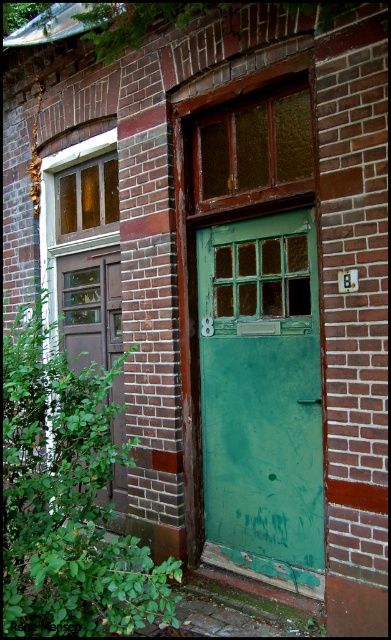
Does wooden textured window at upper center have a lesser height compared to matte brown door at left?

Correct, wooden textured window at upper center is not as tall as matte brown door at left.

Consider the image. Does wooden textured window at upper center have a lesser width compared to matte brown door at left?

Yes.

The width and height of the screenshot is (391, 640). What do you see at coordinates (251, 148) in the screenshot?
I see `wooden textured window at upper center` at bounding box center [251, 148].

Find the location of a particular element. wooden textured window at upper center is located at coordinates (251, 148).

How distant is green matte door at center from wooden textured window at upper center?

The distance of green matte door at center from wooden textured window at upper center is 31.03 inches.

What do you see at coordinates (261, 397) in the screenshot? I see `green matte door at center` at bounding box center [261, 397].

Where is `green matte door at center`? This screenshot has width=391, height=640. green matte door at center is located at coordinates tap(261, 397).

Does green matte door at center have a greater height compared to matte brown door at left?

Yes, green matte door at center is taller than matte brown door at left.

Does green matte door at center appear over matte brown door at left?

Incorrect, green matte door at center is not positioned above matte brown door at left.

Between point (240, 292) and point (116, 477), which one is positioned in front?

Point (240, 292) is in front.

This screenshot has width=391, height=640. In order to click on green matte door at center in this screenshot , I will do `click(261, 397)`.